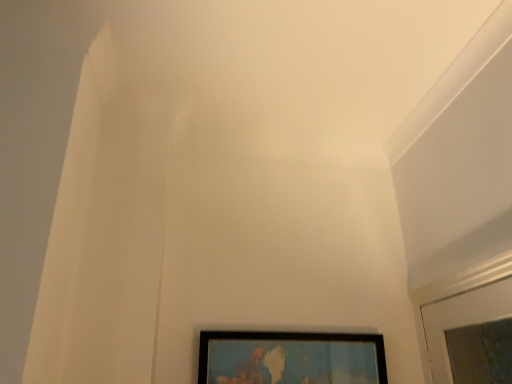
Question: Should I look upward or downward to see wooden map frame at lower center?

Choices:
 (A) up
 (B) down

Answer: (B)